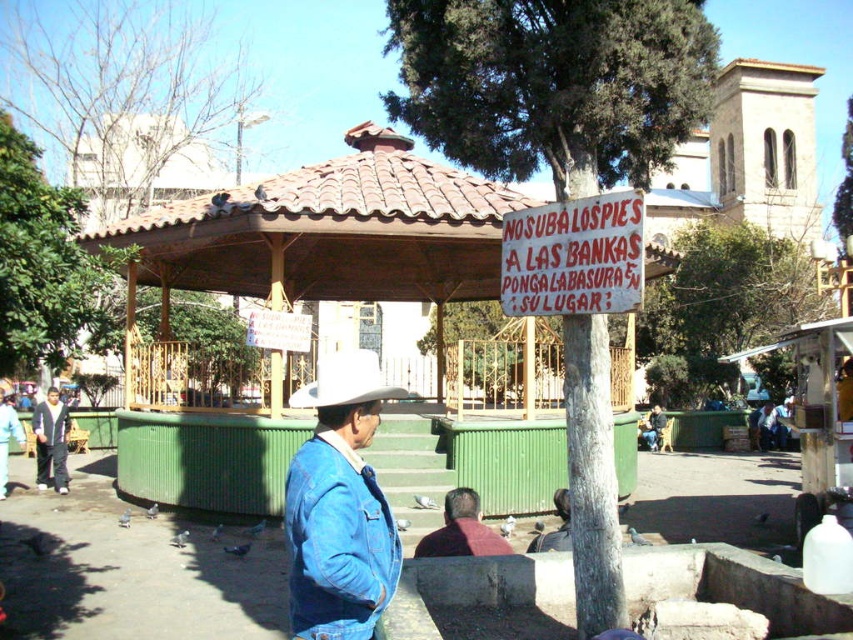
Who is positioned more to the right, brown wood gazebo at center or dark red sweater at lower center?

From the viewer's perspective, dark red sweater at lower center appears more on the right side.

Which is below, brown wood gazebo at center or dark red sweater at lower center?

dark red sweater at lower center is lower down.

Where is `brown wood gazebo at center`? Image resolution: width=853 pixels, height=640 pixels. brown wood gazebo at center is located at coordinates (331, 230).

Where is `brown wood gazebo at center`? The height and width of the screenshot is (640, 853). brown wood gazebo at center is located at coordinates (331, 230).

Is the position of white painted wood sign at center more distant than that of denim jacket at left?

No, it is in front of denim jacket at left.

I want to click on white painted wood sign at center, so click(573, 257).

Is point (583, 310) in front of point (36, 474)?

Yes, point (583, 310) is closer to viewer.

You are a GUI agent. You are given a task and a screenshot of the screen. Output one action in this format:
    pyautogui.click(x=<x>, y=<y>)
    Task: Click on the white painted wood sign at center
    This screenshot has width=853, height=640.
    Given the screenshot: What is the action you would take?
    pyautogui.click(x=573, y=257)

Between brown wood gazebo at center and denim jacket at left, which one has less height?

Standing shorter between the two is denim jacket at left.

Can you confirm if brown wood gazebo at center is positioned below denim jacket at left?

Actually, brown wood gazebo at center is above denim jacket at left.

This screenshot has height=640, width=853. What do you see at coordinates (331, 230) in the screenshot?
I see `brown wood gazebo at center` at bounding box center [331, 230].

At what (x,y) coordinates should I click in order to perform the action: click on brown wood gazebo at center. Please return your answer as a coordinate pair (x, y). Looking at the image, I should click on (331, 230).